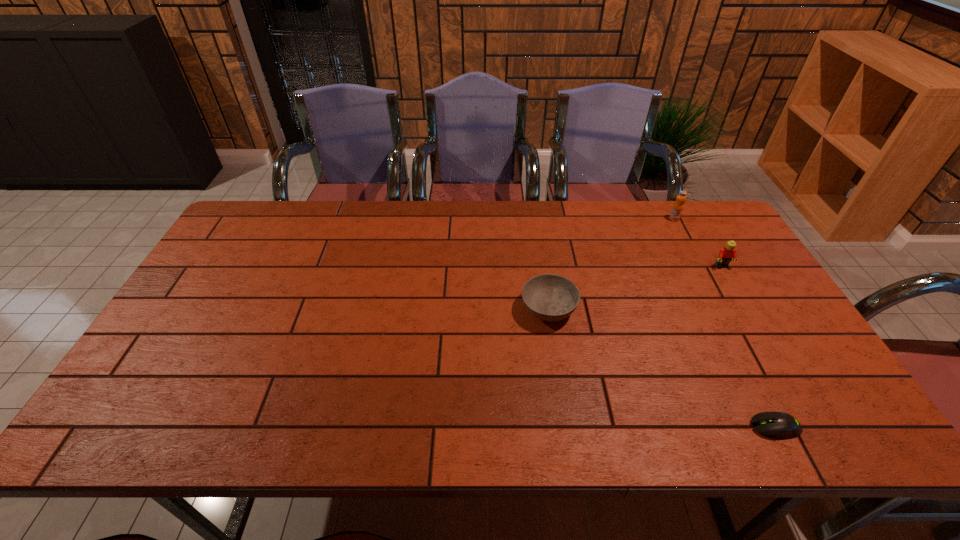
Locate an element on the screen. empty location between the leftmost object and the Lego is located at coordinates (636, 288).

Where is `unoccupied area between the orange juice and the second farthest object`? This screenshot has height=540, width=960. unoccupied area between the orange juice and the second farthest object is located at coordinates (698, 242).

Locate an element on the screen. Image resolution: width=960 pixels, height=540 pixels. free space between the nearest object and the orange juice is located at coordinates (725, 323).

Locate an element on the screen. Image resolution: width=960 pixels, height=540 pixels. free area in between the orange juice and the second farthest object is located at coordinates (698, 242).

In order to click on free space between the second tallest object and the nearest object in this screenshot , I will do `click(748, 347)`.

Locate an element on the screen. object identified as the closest to the bowl is located at coordinates (779, 425).

The image size is (960, 540). I want to click on object that is the second closest to the nearest object, so click(x=726, y=254).

What are the coordinates of `free location that satisfies the following two spatial constraints: 1. on the front label of the orange juice; 2. on the wheel side of the shortest object` in the screenshot? It's located at (783, 427).

Where is `vacant point that satisfies the following two spatial constraints: 1. on the front label of the farthest object; 2. on the wheel side of the shortest object`? vacant point that satisfies the following two spatial constraints: 1. on the front label of the farthest object; 2. on the wheel side of the shortest object is located at coordinates (783, 427).

The width and height of the screenshot is (960, 540). Identify the location of vacant region that satisfies the following two spatial constraints: 1. on the face of the Lego; 2. on the wheel side of the computer mouse. (815, 427).